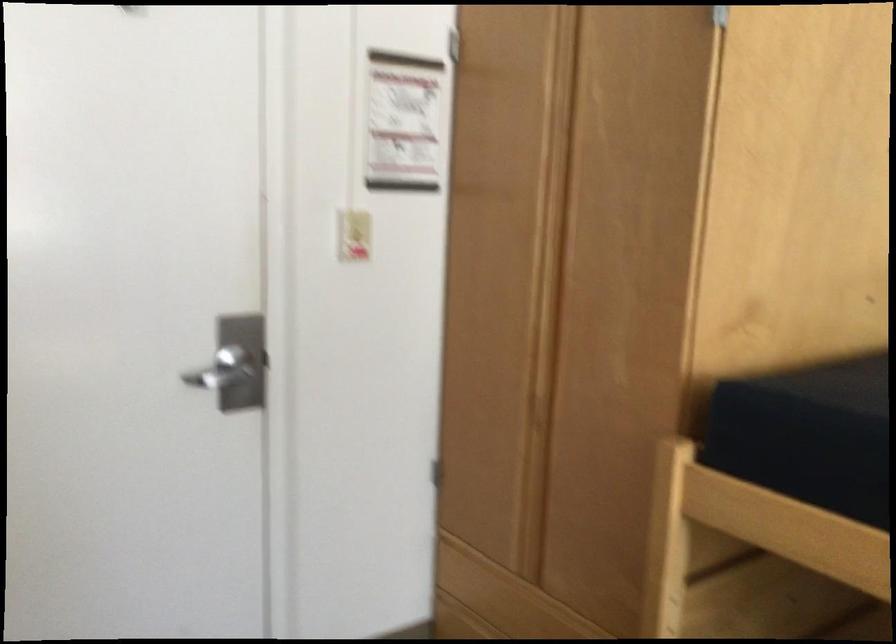
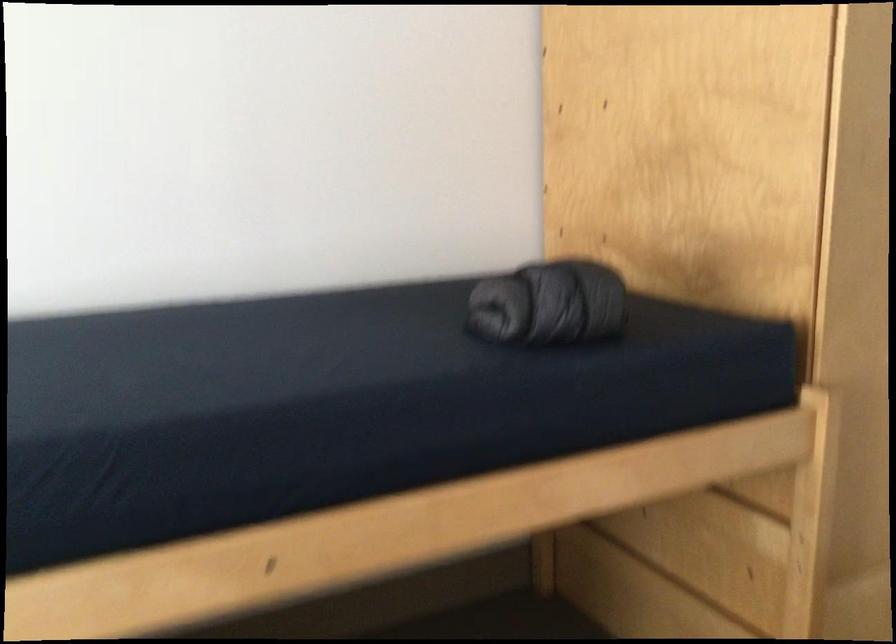
Question: Based on the continuous images, in which direction is the camera rotating? Reply with the corresponding letter.

Choices:
 (A) Left
 (B) Right
 (C) Up
 (D) Down

Answer: (A)